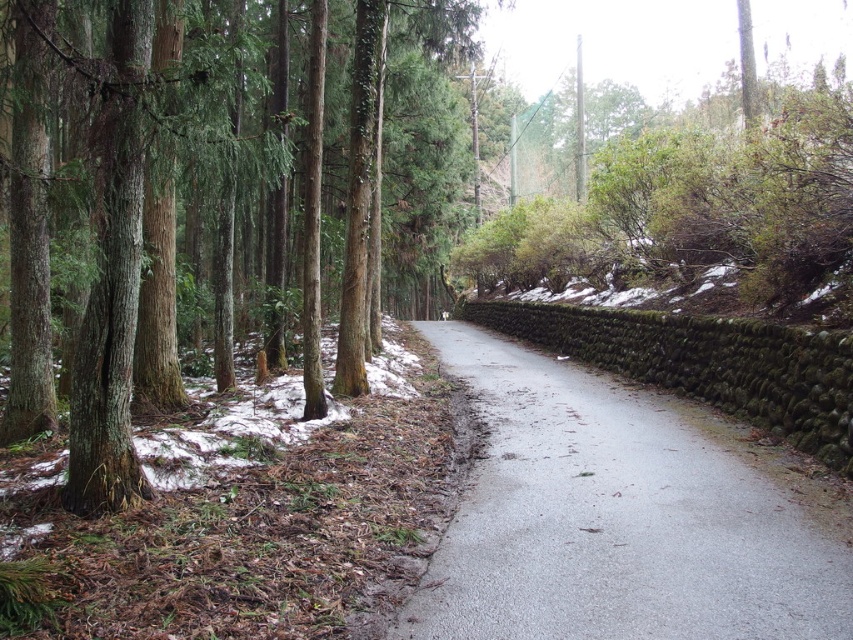
In the scene shown: You are a hiker trying to navigate a narrow forest road. You see two points marked on the map at coordinates point (x=538, y=426) and point (x=68, y=465). Which point should you head towards first if you want to follow the road in its natural direction?

You should head towards point (x=68, y=465) first because point (x=538, y=426) is behind it, meaning the road curves towards the latter after passing the former.

You are standing at the point labeled point (618, 516). Which surface are you currently standing on?

You are standing on the gray asphalt road at center because the point (618, 516) is located on it.

You are a hiker trying to cross the gray asphalt road at center and reach the smooth brown tree trunk at left. Which direction should you walk to get from the road to the tree trunk?

The gray asphalt road at center is to the right of the smooth brown tree trunk at left, so you should walk to the left to reach the tree trunk from the road.